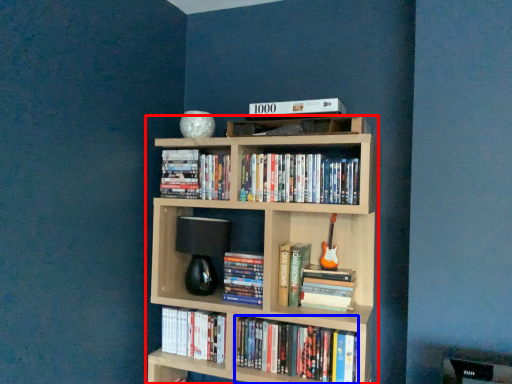
Question: Which object is closer to the camera taking this photo, bookcase (highlighted by a red box) or book (highlighted by a blue box)?

Choices:
 (A) bookcase
 (B) book

Answer: (A)